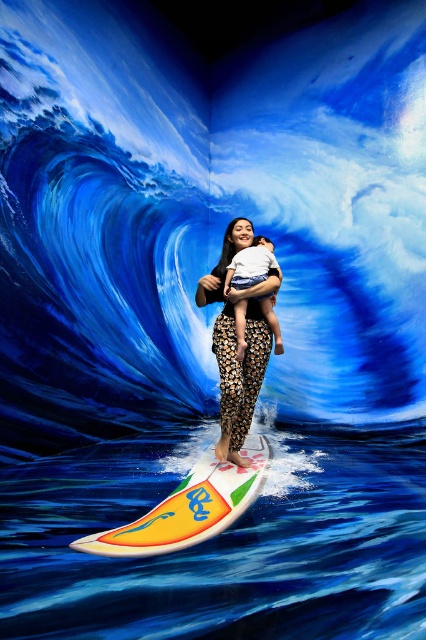
You are an artist analyzing the composition of this surreal image. The scene includes a woman surfing on a wave with a backdrop that creates an illusion of depth. You notice the leopard print pants at center. Where exactly is the leopard print pants located in terms of coordinates?

The leopard print pants at center is located at coordinates point (236, 342).

In the scene shown: You are a photographer standing at the camera position. You want to capture a closeup shot of the leopard print pants at center. Considering the distance, can you get a clear closeup without moving closer?

The leopard print pants at center is 11.05 feet from camera, so a clear closeup can be achieved without moving closer as this distance is sufficient for a photographer to focus and capture details.